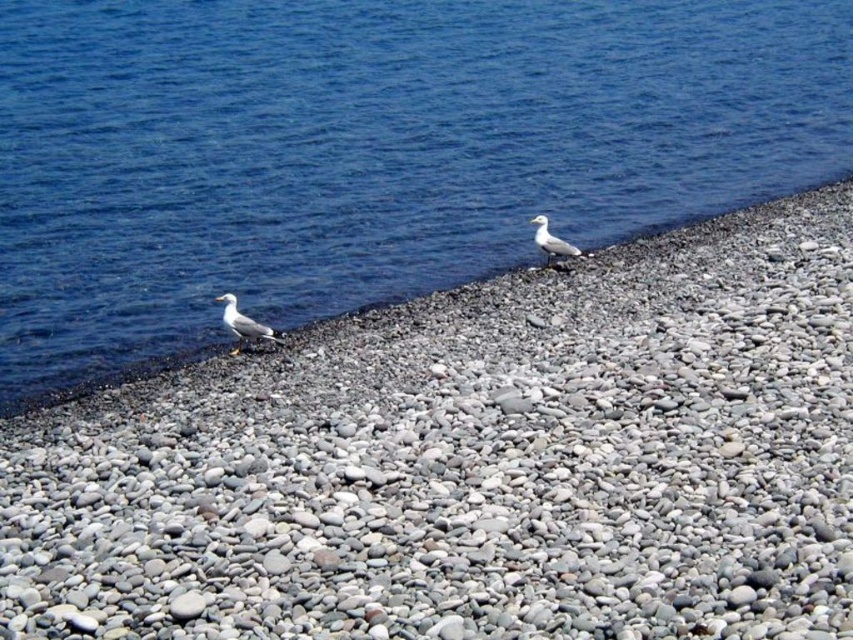
Question: Does white matte seagull at lower left come in front of white feathered bird at center?

Choices:
 (A) yes
 (B) no

Answer: (A)

Question: Can you confirm if gray pebbles at center is positioned above white matte seagull at lower left?

Choices:
 (A) no
 (B) yes

Answer: (A)

Question: Estimate the real-world distances between objects in this image. Which object is closer to the white feathered bird at center?

Choices:
 (A) gray pebbles at center
 (B) white matte seagull at lower left
 (C) blue water at upper left

Answer: (B)

Question: From the image, what is the correct spatial relationship of blue water at upper left in relation to white feathered bird at center?

Choices:
 (A) left
 (B) right

Answer: (A)

Question: Among these points, which one is farthest from the camera?

Choices:
 (A) (253, 321)
 (B) (566, 250)
 (C) (804, 525)
 (D) (819, 148)

Answer: (D)

Question: Which object appears farthest from the camera in this image?

Choices:
 (A) white feathered bird at center
 (B) white matte seagull at lower left
 (C) gray pebbles at center

Answer: (A)